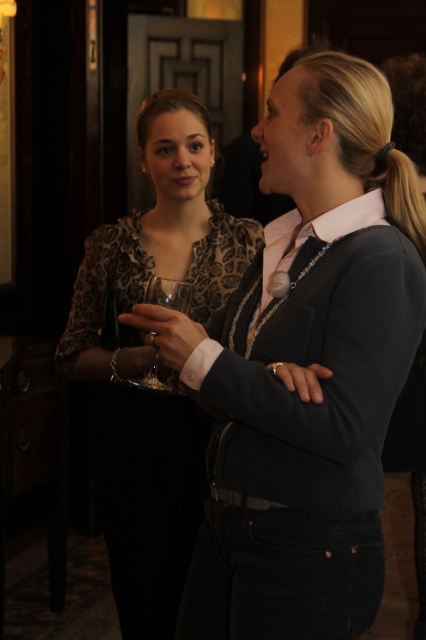
Question: Which of the following is the closest to the observer?

Choices:
 (A) matte brown blouse at center
 (B) clear glass at center
 (C) dark blue corduroy blazer at center

Answer: (C)

Question: Where is dark blue corduroy blazer at center located in relation to clear glass at center in the image?

Choices:
 (A) left
 (B) right

Answer: (B)

Question: Which of the following is the closest to the observer?

Choices:
 (A) dark blue corduroy blazer at center
 (B) matte brown blouse at center

Answer: (A)

Question: Which of the following is the closest to the observer?

Choices:
 (A) (176, 307)
 (B) (173, 500)

Answer: (A)

Question: Is dark blue corduroy blazer at center further to the viewer compared to matte brown blouse at center?

Choices:
 (A) yes
 (B) no

Answer: (B)

Question: Does dark blue corduroy blazer at center have a lesser width compared to matte brown blouse at center?

Choices:
 (A) yes
 (B) no

Answer: (A)